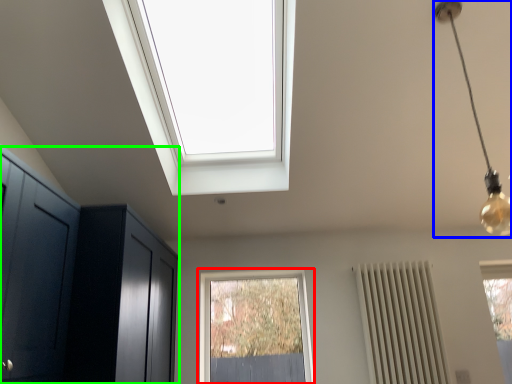
Question: Estimate the real-world distances between objects in this image. Which object is closer to window (highlighted by a red box), light fixture (highlighted by a blue box) or dresser (highlighted by a green box)?

Choices:
 (A) light fixture
 (B) dresser

Answer: (B)